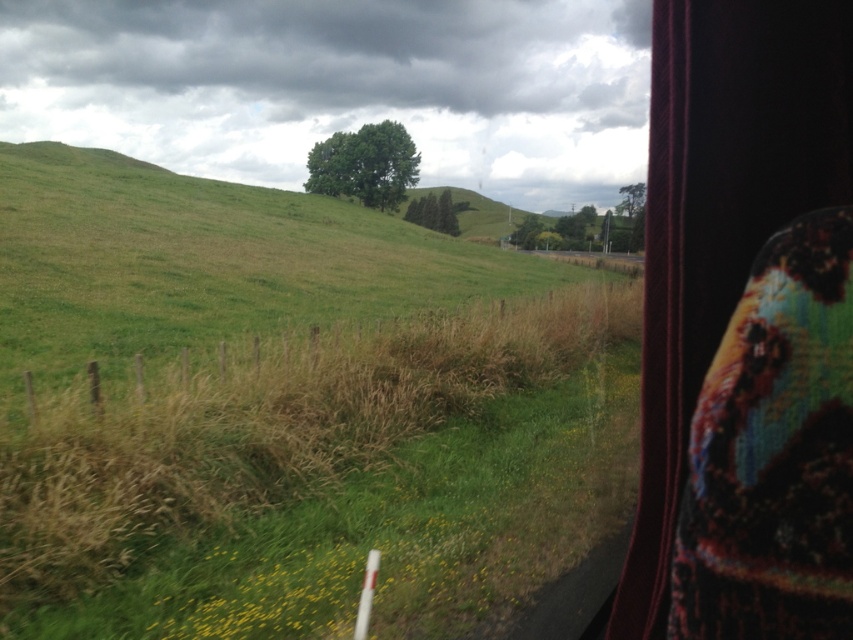
Is point (672, 273) positioned before point (426, 198)?

That is True.

I want to click on velvet dark curtain at right, so click(721, 212).

Locate an element on the screen. velvet dark curtain at right is located at coordinates [721, 212].

Is point (401, 161) in front of point (635, 209)?

Yes, point (401, 161) is closer to viewer.

Does green leafy tree at center have a lesser width compared to green leafy tree at upper center?

No.

The width and height of the screenshot is (853, 640). I want to click on green leafy tree at center, so click(x=364, y=164).

Between green grassy at center and velvet dark curtain at right, which one appears on the right side from the viewer's perspective?

Positioned to the right is green grassy at center.

Can you confirm if green grassy at center is bigger than velvet dark curtain at right?

Indeed, green grassy at center has a larger size compared to velvet dark curtain at right.

Who is more distant from viewer, (x=410, y=428) or (x=782, y=49)?

The point (x=410, y=428) is more distant.

You are a GUI agent. You are given a task and a screenshot of the screen. Output one action in this format:
    pyautogui.click(x=<x>, y=<y>)
    Task: Click on the green grassy at center
    This screenshot has height=640, width=853.
    Given the screenshot: What is the action you would take?
    pyautogui.click(x=334, y=483)